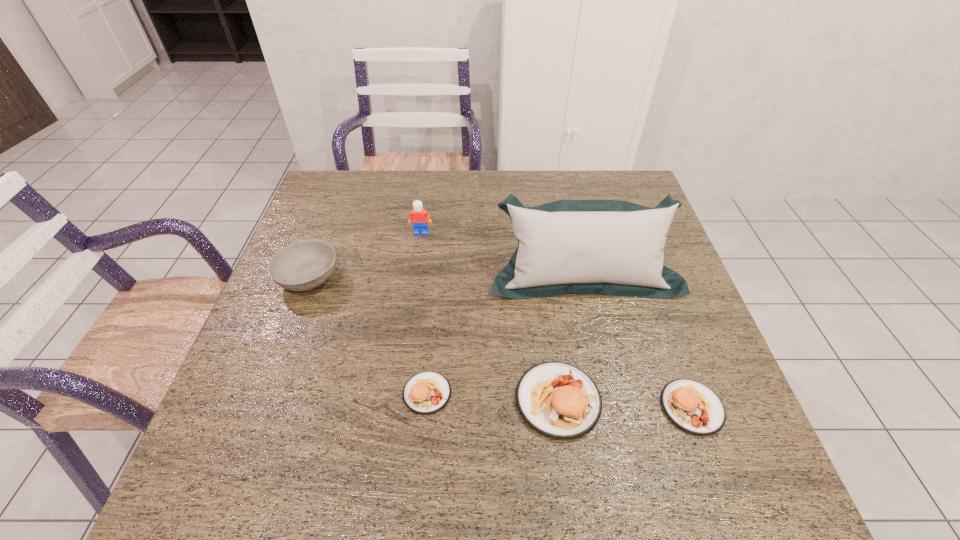
You are a GUI agent. You are given a task and a screenshot of the screen. Output one action in this format:
    pyautogui.click(x=<x>, y=<y>)
    Task: Click on the free space located on the back of the second patty from right to left
    
    Given the screenshot: What is the action you would take?
    pyautogui.click(x=537, y=245)

The image size is (960, 540). What are the coordinates of `free region located 0.160m on the back of the rightmost patty` in the screenshot? It's located at (660, 321).

Identify the location of free space located on the face of the Lego. (411, 304).

In order to click on vacant space located 0.240m on the surface of the tallest object in this screenshot , I will do `click(610, 386)`.

This screenshot has height=540, width=960. Find the location of `vacant area situated on the right of the leftmost object`. vacant area situated on the right of the leftmost object is located at coordinates (364, 278).

In order to click on object that is at the left edge in this screenshot , I will do `click(301, 266)`.

Locate an element on the screen. The height and width of the screenshot is (540, 960). patty positioned at the right edge is located at coordinates (693, 407).

Identify the location of cushion situated at the right edge. This screenshot has height=540, width=960. (610, 247).

Identify the location of object at the near right corner. The height and width of the screenshot is (540, 960). (693, 407).

Find the location of `vacant space at the far edge of the desktop`. vacant space at the far edge of the desktop is located at coordinates (391, 181).